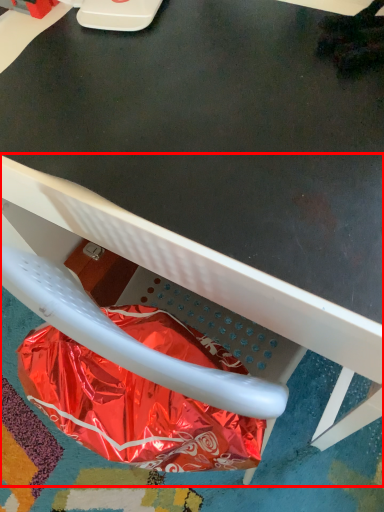
Question: From the image's perspective, where is chair (annotated by the red box) located in relation to paper bag in the image?

Choices:
 (A) below
 (B) above

Answer: (B)